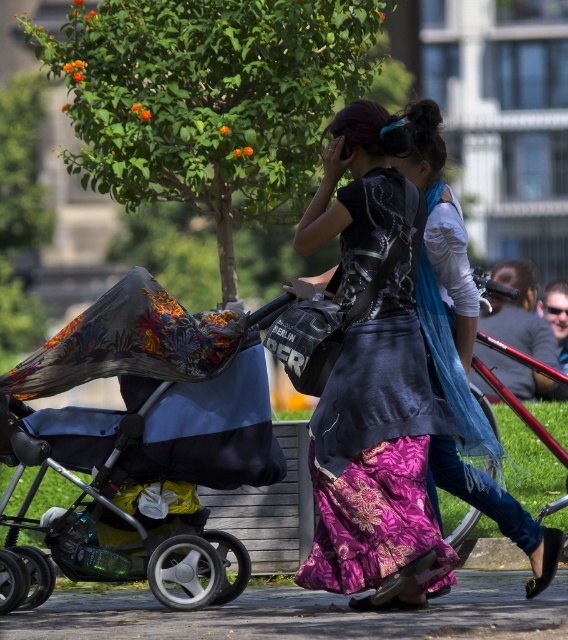
You are a delivery person carrying a box that is 1.8 meters long. You need to navigate through the park scene shown in the image. There is a blue fabric stroller at left and a matte black jacket at center. Can you pass between them without tilting the box sideways?

The blue fabric stroller at left and matte black jacket at center are 1.75 meters apart. Since the box is 1.8 meters long, it is slightly longer than the space between them. Therefore, you cannot pass between them without tilting the box sideways.